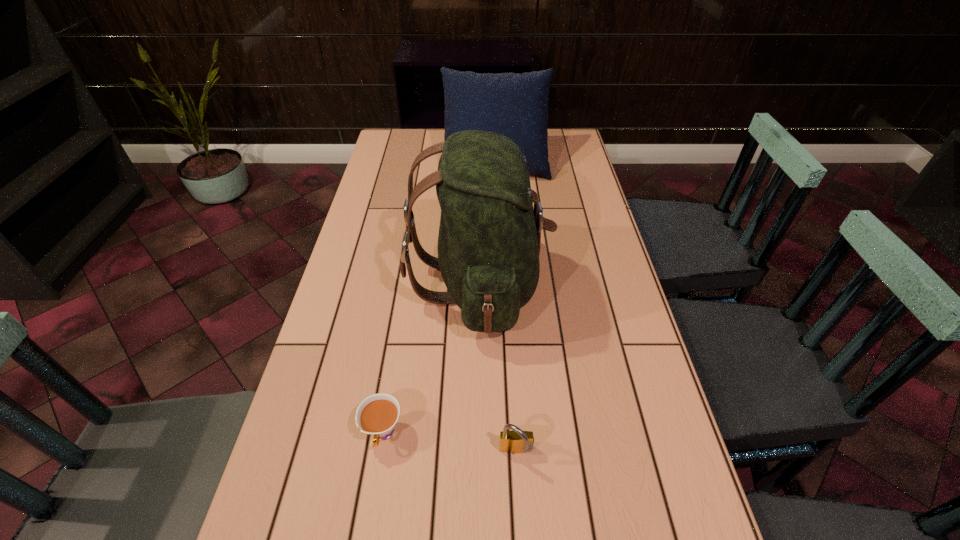
This screenshot has width=960, height=540. Identify the location of vacant space that's between the padlock and the shortest object. (449, 443).

Image resolution: width=960 pixels, height=540 pixels. I want to click on the closest object relative to the tallest object, so click(x=377, y=415).

Select which object appears as the third closest to the shortest object. Please provide its 2D coordinates. Your answer should be formatted as a tuple, i.e. [(x, y)], where the tuple contains the x and y coordinates of a point satisfying the conditions above.

[(515, 105)]

Identify the location of free point that satisfies the following two spatial constraints: 1. on the open flap of the tallest object; 2. on the side of the shortest object with the handle. (479, 434).

Where is `vacant position in the image that satisfies the following two spatial constraints: 1. on the facing side of the second tallest object; 2. on the open flap of the backpack`? Image resolution: width=960 pixels, height=540 pixels. vacant position in the image that satisfies the following two spatial constraints: 1. on the facing side of the second tallest object; 2. on the open flap of the backpack is located at coordinates (501, 284).